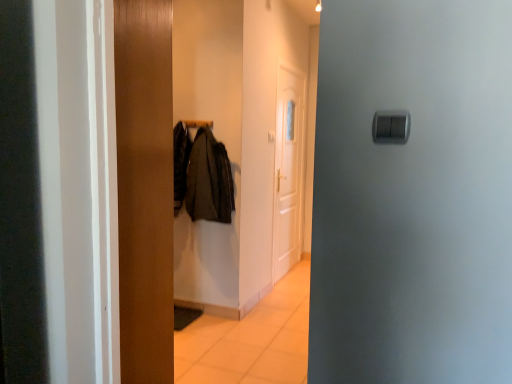
Question: Considering the positions of wooden door at center, which is the 1th door from front to back, and wooden coat rack at center in the image, is wooden door at center, which is the 1th door from front to back, taller or shorter than wooden coat rack at center?

Choices:
 (A) short
 (B) tall

Answer: (B)

Question: Does point (129, 125) appear closer or farther from the camera than point (273, 64)?

Choices:
 (A) farther
 (B) closer

Answer: (B)

Question: Estimate the real-world distances between objects in this image. Which object is farther from the metallic coat hanger at center?

Choices:
 (A) wooden coat rack at center
 (B) white glossy door at center, positioned as the first door in back-to-front order
 (C) wooden door at center, which is the 1th door from front to back
 (D) dark gray fabric coat at center

Answer: (C)

Question: Considering the real-world distances, which object is farthest from the wooden coat rack at center?

Choices:
 (A) dark gray fabric coat at center
 (B) metallic coat hanger at center
 (C) wooden door at center, which is counted as the 1th door, starting from the left
 (D) white glossy door at center, positioned as the first door in back-to-front order

Answer: (C)